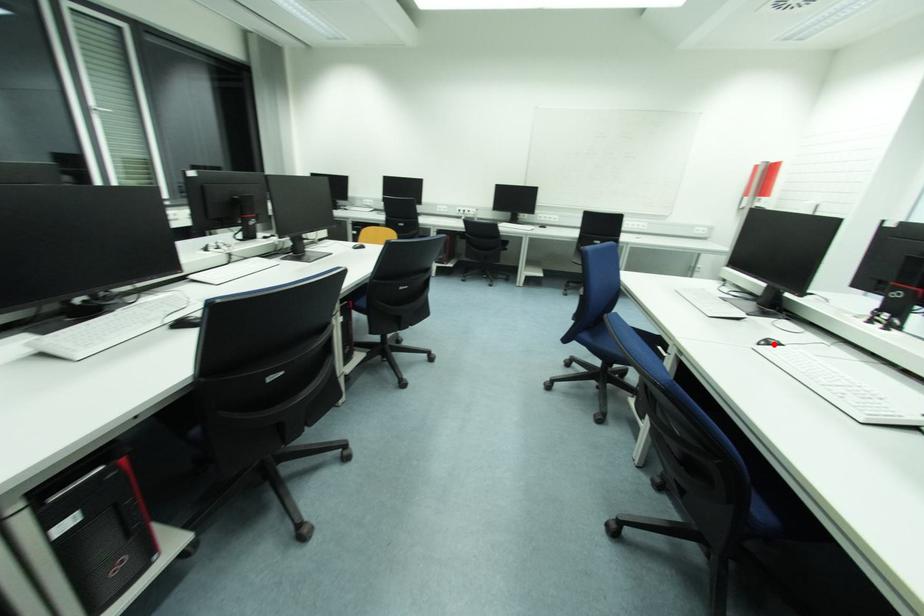
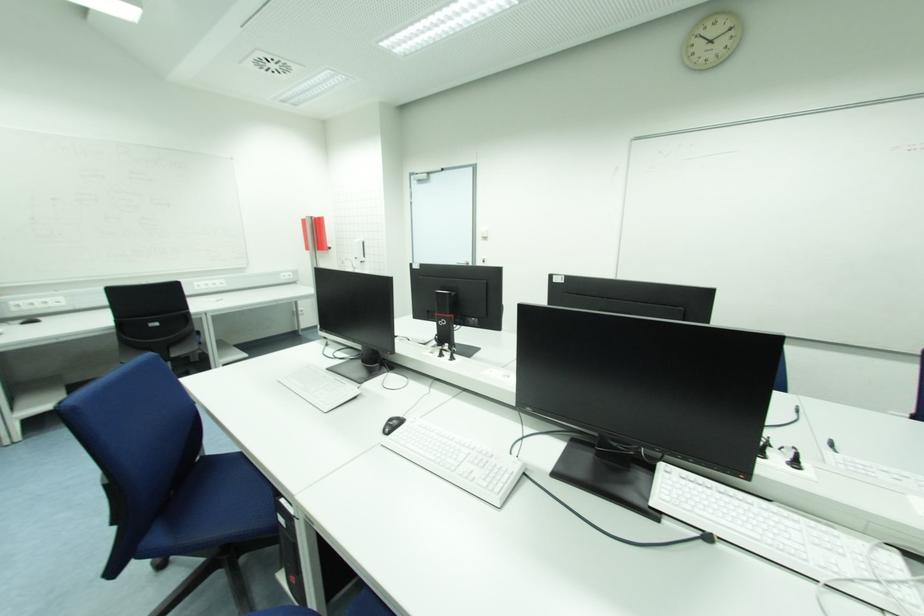
Locate, in the second image, the point that corresponds to the highlighted location in the first image.

(395, 426)